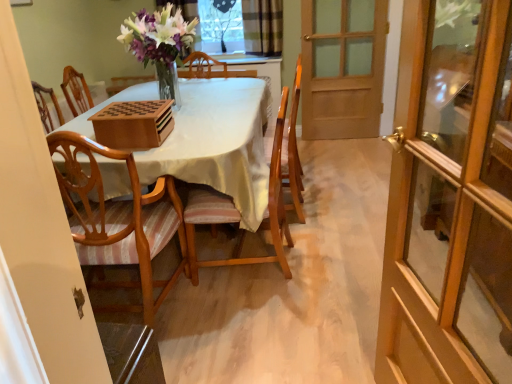
Question: Can we say clear glass window at upper center lies outside wooden door at right, which is counted as the 2th door, starting from the bottom?

Choices:
 (A) yes
 (B) no

Answer: (A)

Question: Is clear glass window at upper center bigger than wooden door at right, the 1th door viewed from the back?

Choices:
 (A) yes
 (B) no

Answer: (B)

Question: Can you confirm if clear glass window at upper center is smaller than wooden door at right, which ranks as the first door in top-to-bottom order?

Choices:
 (A) no
 (B) yes

Answer: (B)

Question: Is clear glass window at upper center at the right side of wooden door at right, arranged as the 2th door when viewed from the front?

Choices:
 (A) yes
 (B) no

Answer: (B)

Question: From the image's perspective, is clear glass window at upper center over wooden door at right, which is counted as the 2th door, starting from the bottom?

Choices:
 (A) no
 (B) yes

Answer: (B)

Question: Is light brown wood chair at left, which is the 1th chair from left to right, to the left or to the right of wooden table at center in the image?

Choices:
 (A) left
 (B) right

Answer: (A)

Question: Which is correct: light brown wood chair at left, the 2th chair when ordered from right to left, is inside wooden table at center, or outside of it?

Choices:
 (A) outside
 (B) inside

Answer: (B)

Question: Relative to wooden table at center, is light brown wood chair at left, which is the 1th chair from left to right, in front or behind?

Choices:
 (A) behind
 (B) front

Answer: (B)

Question: Based on their sizes in the image, would you say light brown wood chair at left, which is the 1th chair from left to right, is bigger or smaller than wooden table at center?

Choices:
 (A) small
 (B) big

Answer: (A)

Question: In the image, is wooden door at right, the 1th door viewed from the back, positioned in front of or behind light brown wood chair at left, the 2th chair when ordered from right to left?

Choices:
 (A) front
 (B) behind

Answer: (B)

Question: From a real-world perspective, is wooden door at right, which ranks as the first door in top-to-bottom order, positioned above or below light brown wood chair at left, the 2th chair when ordered from right to left?

Choices:
 (A) above
 (B) below

Answer: (A)

Question: From their relative heights in the image, would you say wooden door at right, the 1th door viewed from the back, is taller or shorter than light brown wood chair at left, which is the 1th chair from left to right?

Choices:
 (A) short
 (B) tall

Answer: (B)

Question: Is wooden door at right, arranged as the 2th door when viewed from the front, inside the boundaries of light brown wood chair at left, which is the 1th chair from left to right, or outside?

Choices:
 (A) inside
 (B) outside

Answer: (B)

Question: Which is correct: wooden glass door at right, placed as the 2th door when sorted from back to front, is inside clear glass window at upper center, or outside of it?

Choices:
 (A) inside
 (B) outside

Answer: (B)

Question: In terms of size, does wooden glass door at right, placed as the 2th door when sorted from back to front, appear bigger or smaller than clear glass window at upper center?

Choices:
 (A) big
 (B) small

Answer: (A)